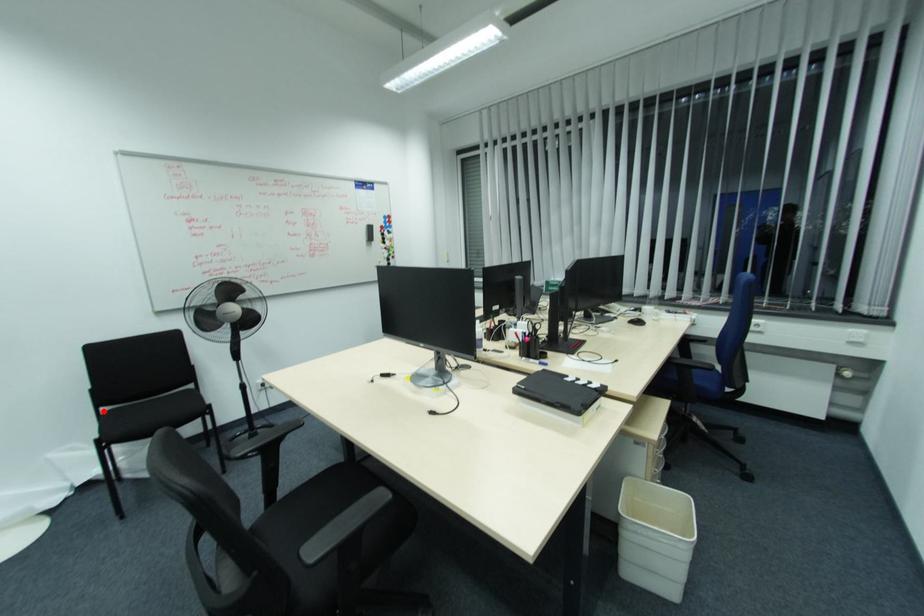
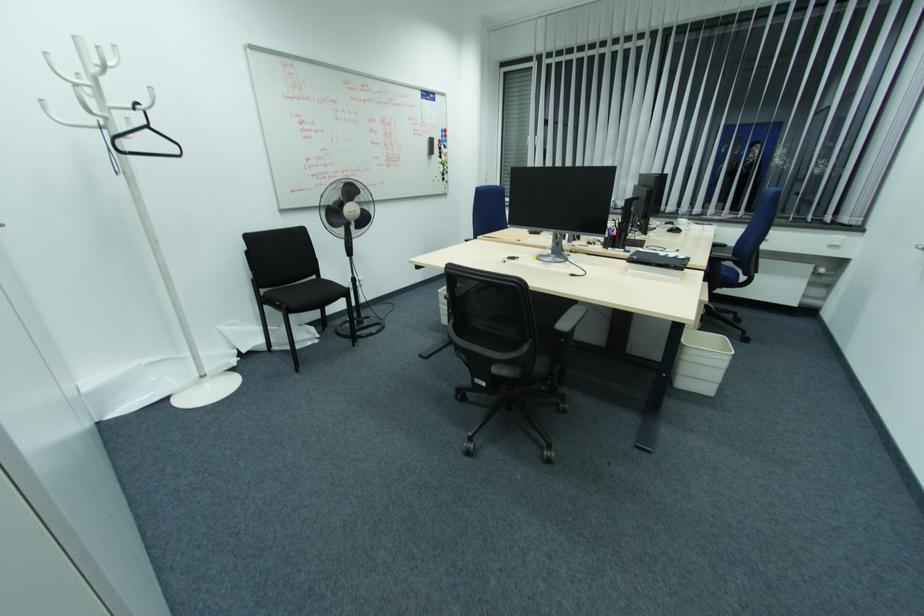
Question: I am providing you with two images of the same scene from different viewpoints. In image1, a red point is highlighted. Considering the same 3D point in image2, which of the following is correct?

Choices:
 (A) It is closer
 (B) It is farther

Answer: (B)